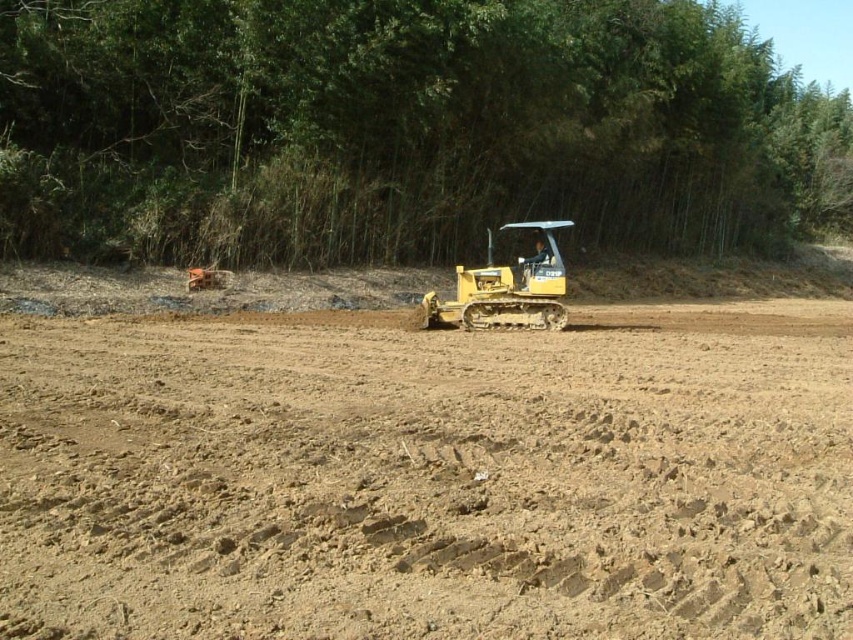
Does brown sandy dirt at center appear over green bamboo at upper center?

No.

Does brown sandy dirt at center lie behind green bamboo at upper center?

No, brown sandy dirt at center is in front of green bamboo at upper center.

Find the location of a particular element. The width and height of the screenshot is (853, 640). brown sandy dirt at center is located at coordinates (424, 481).

What do you see at coordinates (424, 481) in the screenshot? I see `brown sandy dirt at center` at bounding box center [424, 481].

Which is more to the left, brown sandy dirt at center or yellow rubber tractor at center?

Positioned to the left is brown sandy dirt at center.

This screenshot has width=853, height=640. What are the coordinates of `brown sandy dirt at center` in the screenshot? It's located at (424, 481).

Is green bamboo at upper center smaller than yellow rubber tractor at center?

Incorrect, green bamboo at upper center is not smaller in size than yellow rubber tractor at center.

Measure the distance between green bamboo at upper center and camera.

The distance of green bamboo at upper center from camera is 23.20 meters.

Identify the location of green bamboo at upper center. (399, 125).